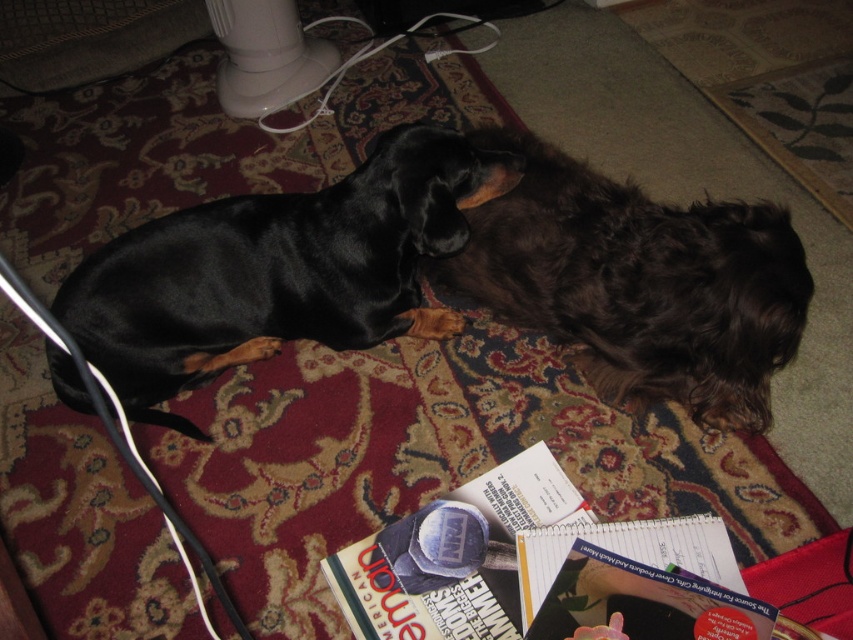
Who is more distant from viewer, (465,177) or (677,369)?

The point (677,369) is behind.

The width and height of the screenshot is (853, 640). What do you see at coordinates (277, 269) in the screenshot? I see `black shiny dog at left` at bounding box center [277, 269].

Between point (131, 234) and point (582, 244), which one is positioned in front?

Point (582, 244) is more forward.

In order to click on black shiny dog at left in this screenshot , I will do `click(277, 269)`.